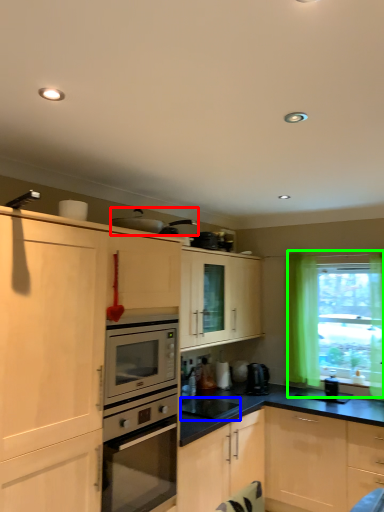
Question: Estimate the real-world distances between objects in this image. Which object is farther from appliance (highlighted by a red box), appliance (highlighted by a blue box) or window (highlighted by a green box)?

Choices:
 (A) appliance
 (B) window

Answer: (B)